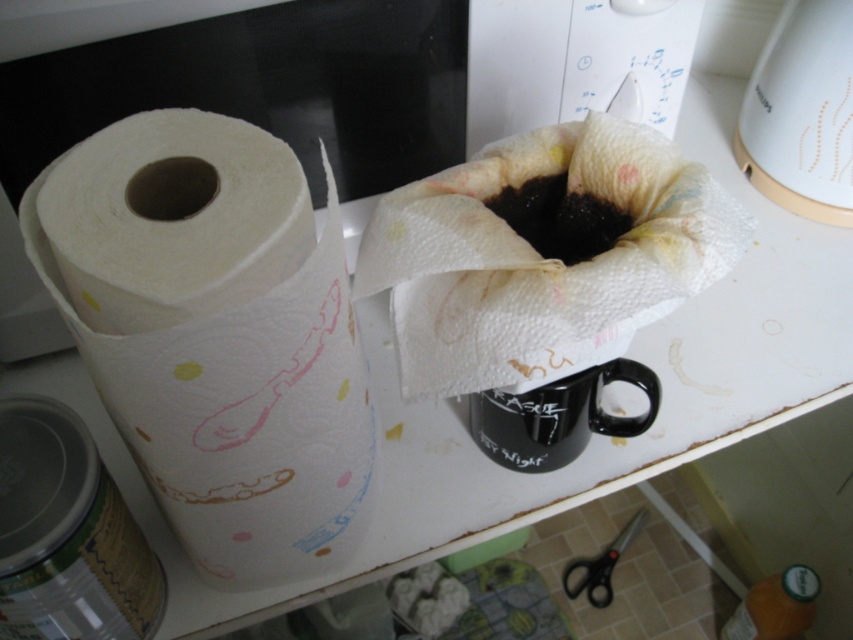
Can you confirm if white textured paper towel at center is bigger than black plastic scissors at lower center?

Indeed, white textured paper towel at center has a larger size compared to black plastic scissors at lower center.

Find the location of `white textured paper towel at center`. white textured paper towel at center is located at coordinates (543, 252).

Does point (410, 320) lie in front of point (607, 572)?

That is True.

I want to click on white textured paper towel at center, so click(x=543, y=252).

Between white paper towel at left and white glossy coffee maker at upper right, which one has more height?

white paper towel at left

Can you confirm if white paper towel at left is positioned to the left of white glossy coffee maker at upper right?

Indeed, white paper towel at left is positioned on the left side of white glossy coffee maker at upper right.

Is point (192, 164) positioned behind point (792, 96)?

That is False.

Locate an element on the screen. white paper towel at left is located at coordinates (215, 333).

Can you confirm if white glossy microwave at upper center is taller than black matte coffee at center?

Indeed, white glossy microwave at upper center has a greater height compared to black matte coffee at center.

Does point (120, 51) come farther from viewer compared to point (526, 193)?

No.

Where is `white glossy microwave at upper center`? white glossy microwave at upper center is located at coordinates (225, 97).